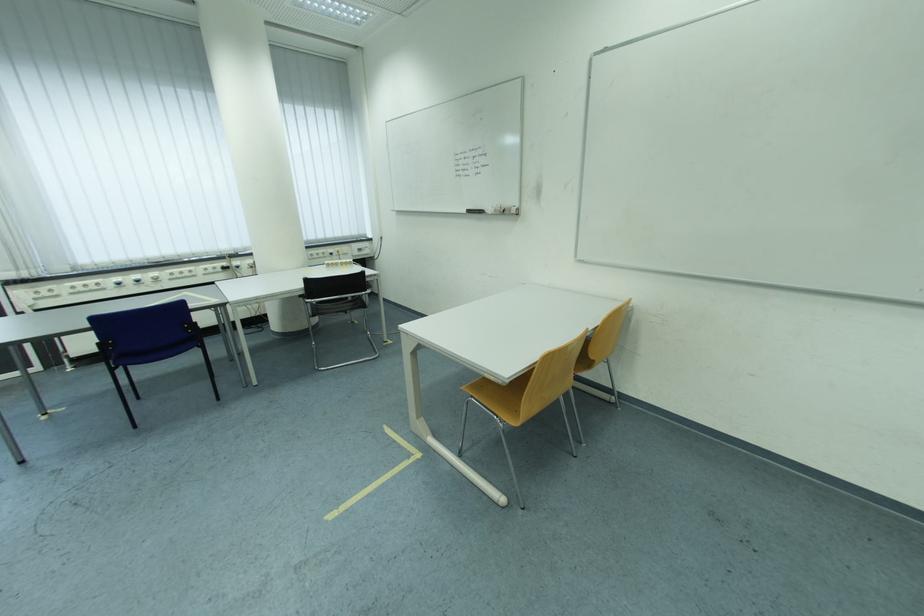
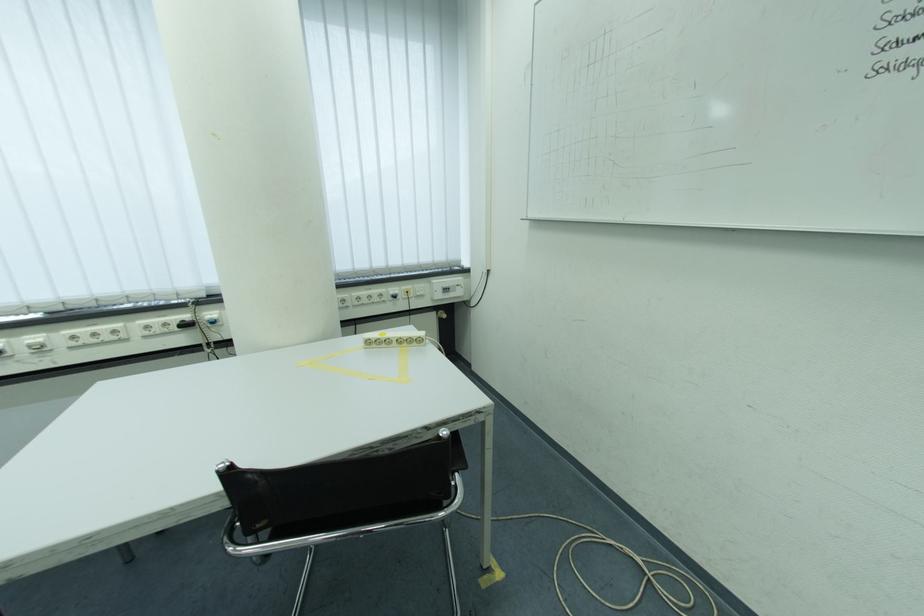
Where in the second image is the point corresponding to (180,277) from the first image?

(82, 339)